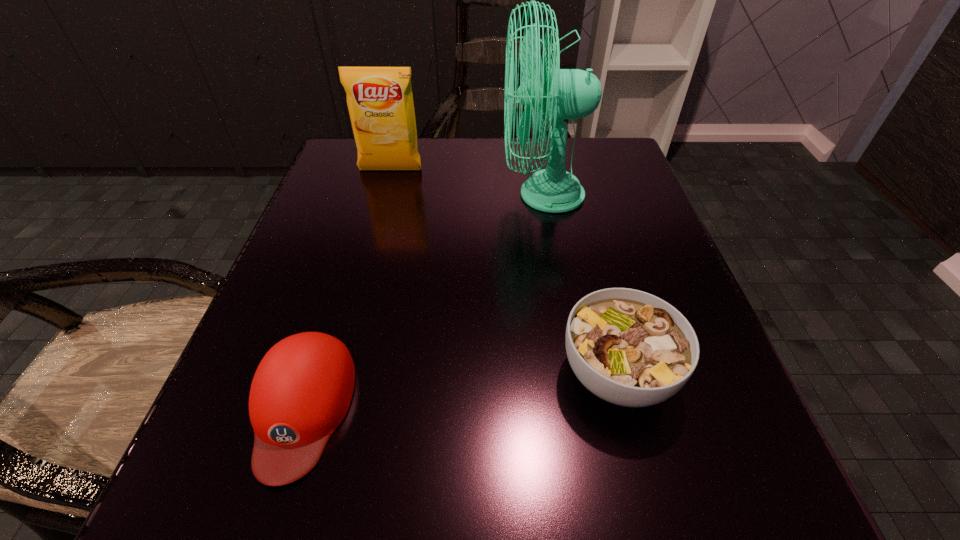
Image resolution: width=960 pixels, height=540 pixels. What are the coordinates of `fan` in the screenshot? It's located at (570, 93).

This screenshot has height=540, width=960. Identify the location of the third shortest object. (380, 102).

At what (x,y) coordinates should I click in order to perform the action: click on soup bowl. Please return your answer as a coordinate pair (x, y). Looking at the image, I should click on (628, 347).

This screenshot has height=540, width=960. I want to click on baseball cap, so click(301, 391).

The height and width of the screenshot is (540, 960). I want to click on free space located in front of the fan to blow air, so click(x=365, y=195).

This screenshot has width=960, height=540. Identify the location of vacant space situated in front of the fan to blow air. (399, 195).

What are the coordinates of `free space located 0.290m in front of the fan to blow air` in the screenshot? It's located at (354, 195).

Where is `vacant space situated 0.120m on the front of the crisp (potato chip) with the logo`? The image size is (960, 540). vacant space situated 0.120m on the front of the crisp (potato chip) with the logo is located at coordinates (380, 211).

Where is `free location located on the left of the soup bowl`? This screenshot has height=540, width=960. free location located on the left of the soup bowl is located at coordinates click(461, 374).

Image resolution: width=960 pixels, height=540 pixels. I want to click on fan present at the far edge, so click(x=570, y=93).